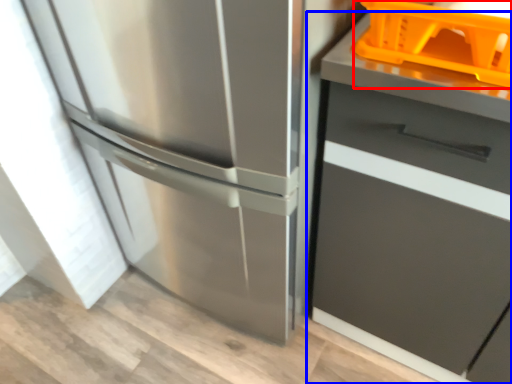
Question: Which point is closer to the camera, basket (highlighted by a red box) or cabinetry (highlighted by a blue box)?

Choices:
 (A) basket
 (B) cabinetry

Answer: (B)